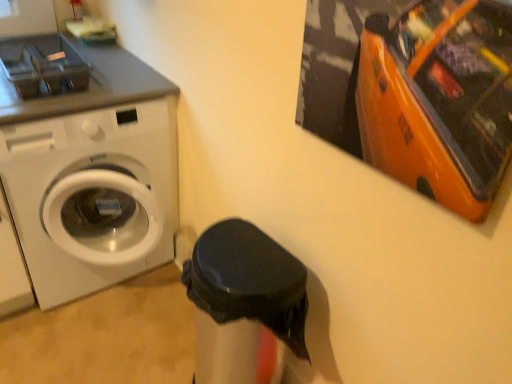
Image resolution: width=512 pixels, height=384 pixels. What do you see at coordinates (245, 304) in the screenshot?
I see `black matte trash can at center` at bounding box center [245, 304].

The width and height of the screenshot is (512, 384). In order to click on black matte trash can at center in this screenshot , I will do `click(245, 304)`.

What do you see at coordinates (92, 196) in the screenshot?
I see `white glossy washing machine at left` at bounding box center [92, 196].

Measure the distance between point [76,293] and camera.

Point [76,293] and camera are 1.79 meters apart.

You are a GUI agent. You are given a task and a screenshot of the screen. Output one action in this format:
    pyautogui.click(x=<x>, y=<y>)
    Task: Click on the white glossy washing machine at left
    Image resolution: width=512 pixels, height=384 pixels.
    Given the screenshot: What is the action you would take?
    [x=92, y=196]

At what (x,y) coordinates should I click in order to perform the action: click on black matte trash can at center. Please return your answer as a coordinate pair (x, y). This screenshot has height=384, width=512. Looking at the image, I should click on (245, 304).

Is white glossy washing machine at left to the left of black matte trash can at center from the viewer's perspective?

Indeed, white glossy washing machine at left is positioned on the left side of black matte trash can at center.

Which object is further away from the camera taking this photo, white glossy washing machine at left or black matte trash can at center?

white glossy washing machine at left.

Which is further, (91, 182) or (302, 336)?

The point (91, 182) is farther.

From the picture: From the image's perspective, between white glossy washing machine at left and black matte trash can at center, who is located below?

black matte trash can at center, from the image's perspective.

In the scene shown: From a real-world perspective, which object stands above the other?

From a 3D spatial view, white glossy washing machine at left is above.

Does white glossy washing machine at left have a greater width compared to black matte trash can at center?

Indeed, white glossy washing machine at left has a greater width compared to black matte trash can at center.

Does white glossy washing machine at left have a lesser height compared to black matte trash can at center?

Incorrect, the height of white glossy washing machine at left does not fall short of that of black matte trash can at center.

Can you confirm if white glossy washing machine at left is smaller than black matte trash can at center?

Actually, white glossy washing machine at left might be larger than black matte trash can at center.

Do you think white glossy washing machine at left is within black matte trash can at center, or outside of it?

The correct answer is: outside.

Is white glossy washing machine at left next to black matte trash can at center?

No.

Is white glossy washing machine at left turned away from black matte trash can at center?

No, black matte trash can at center is not at the back of white glossy washing machine at left.

The image size is (512, 384). Find the location of `washing machine above the black matte trash can at center (from a real-world perspective)`. washing machine above the black matte trash can at center (from a real-world perspective) is located at coordinates (92, 196).

Does black matte trash can at center appear on the left side of white glossy washing machine at left?

No, black matte trash can at center is not to the left of white glossy washing machine at left.

Between black matte trash can at center and white glossy washing machine at left, which one is positioned in front?

Positioned in front is black matte trash can at center.

Is point (295, 312) closer to viewer compared to point (45, 128)?

Yes, it is.

From the image's perspective, which one is positioned higher, black matte trash can at center or white glossy washing machine at left?

white glossy washing machine at left.

From a real-world perspective, between black matte trash can at center and white glossy washing machine at left, who is vertically higher?

In real-world perspective, white glossy washing machine at left is above.

Considering the relative sizes of black matte trash can at center and white glossy washing machine at left in the image provided, is black matte trash can at center wider than white glossy washing machine at left?

No, black matte trash can at center is not wider than white glossy washing machine at left.

Does black matte trash can at center have a lesser height compared to white glossy washing machine at left?

Correct, black matte trash can at center is not as tall as white glossy washing machine at left.

Does black matte trash can at center have a smaller size compared to white glossy washing machine at left?

Yes.

Is black matte trash can at center not within white glossy washing machine at left?

black matte trash can at center is positioned outside white glossy washing machine at left.

Is there a large distance between black matte trash can at center and white glossy washing machine at left?

No.

Is black matte trash can at center looking in the opposite direction of white glossy washing machine at left?

No.

Measure the distance from black matte trash can at center to white glossy washing machine at left.

black matte trash can at center is 23.58 inches from white glossy washing machine at left.

The image size is (512, 384). What are the coordinates of `garbage on the right of white glossy washing machine at left` in the screenshot? It's located at click(x=245, y=304).

Locate an element on the screen. garbage located in front of the white glossy washing machine at left is located at coordinates (245, 304).

Where is `washing machine on the left of black matte trash can at center`? washing machine on the left of black matte trash can at center is located at coordinates (92, 196).